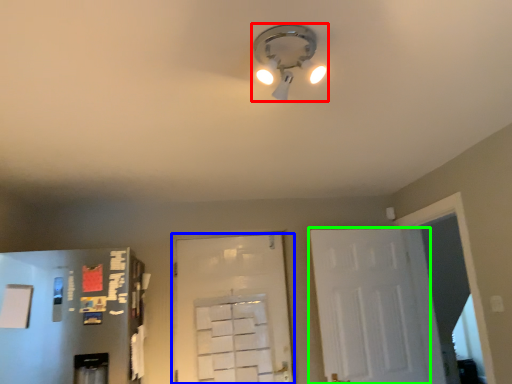
Question: Which object is positioned closest to lamp (highlighted by a red box)? Select from door (highlighted by a blue box) and door (highlighted by a green box).

Choices:
 (A) door
 (B) door

Answer: (B)